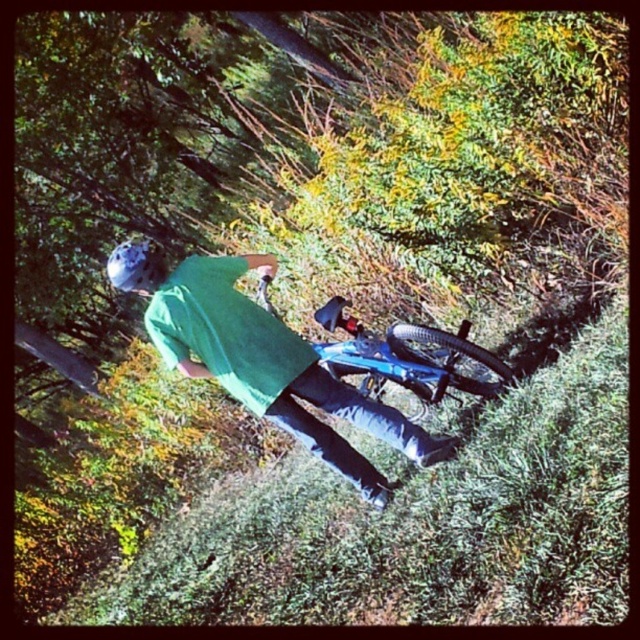
You are a photographer trying to capture a clear shot of both the blue matte mountain bike at center and the matte blue helmet at upper left. Which object should you focus on first if you want to ensure both are in focus without moving your camera?

The blue matte mountain bike at center is positioned under the matte blue helmet at upper left, so focusing on the helmet first will ensure both are in focus as the bike is closer to the camera.

You are a safety inspector checking the scene of a biking accident. You notice the blue matte mountain bike at center and the matte blue helmet at upper left. Which object is bigger in size?

The blue matte mountain bike at center has a larger size compared to the matte blue helmet at upper left, so the blue matte mountain bike at center is bigger.

You are a safety inspector evaluating the scene. You notice the blue matte mountain bike at center and the matte blue helmet at upper left. Which object is wider?

The blue matte mountain bike at center is wider than the matte blue helmet at upper left.